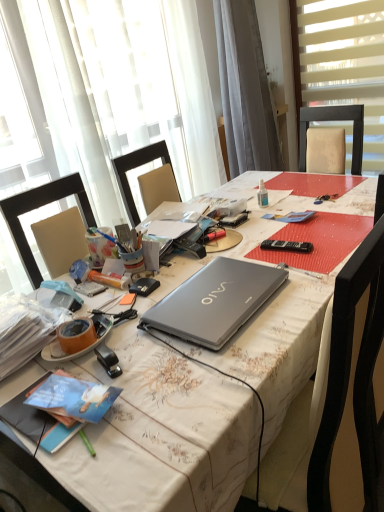
Image resolution: width=384 pixels, height=512 pixels. What are the coordinates of `free point behind blue paperback book at lower left, acting as the 1th book starting from the top` in the screenshot? It's located at (101, 357).